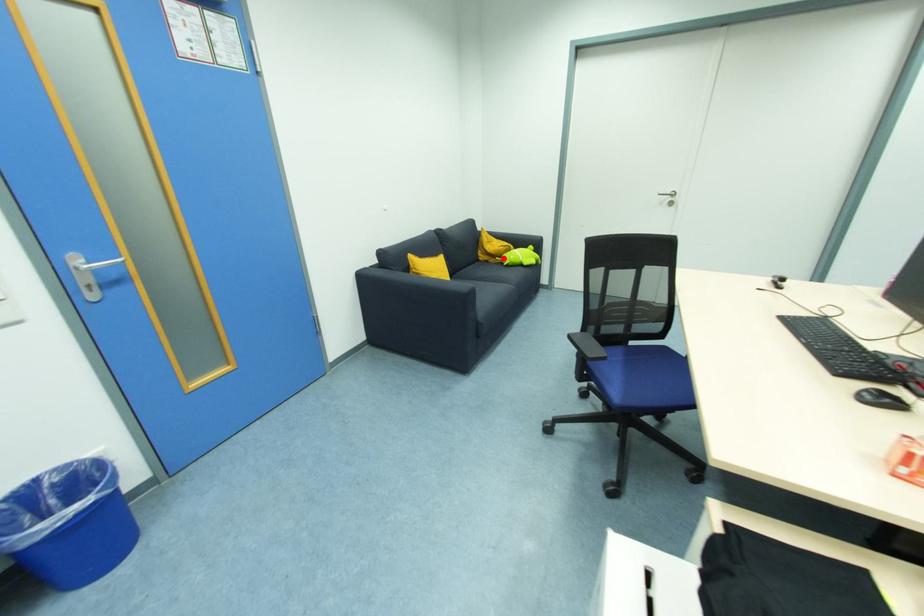
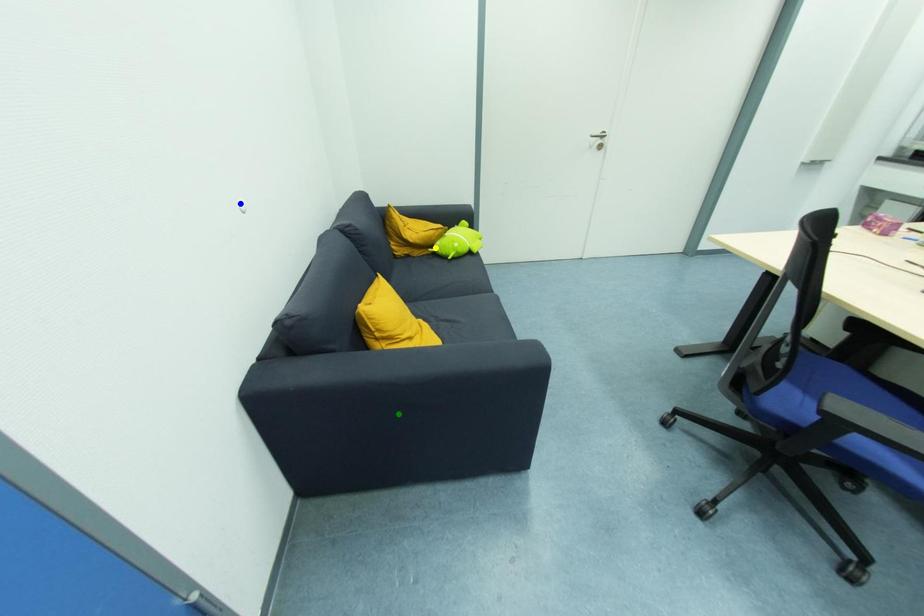
Question: I am providing you with two images of the same scene from different viewpoints. A red point is marked on the first image. You are given multiple points on the second image. Which point in image 2 represents the same 3d spot as the red point in image 1?

Choices:
 (A) green point
 (B) blue point
 (C) yellow point

Answer: (C)